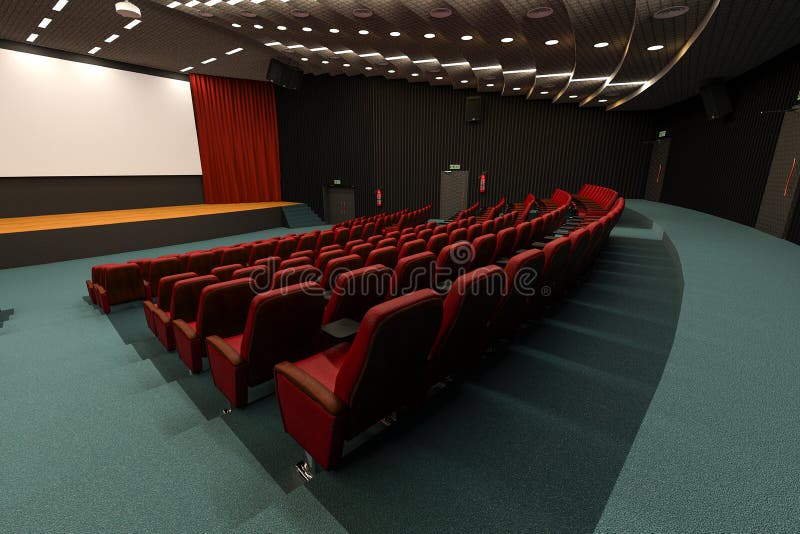
You are a GUI agent. You are given a task and a screenshot of the screen. Output one action in this format:
    pyautogui.click(x=<x>, y=<y>)
    Task: Click on the stage steps
    Image resolution: width=800 pixels, height=534 pixels.
    Given the screenshot: What is the action you would take?
    pyautogui.click(x=296, y=226), pyautogui.click(x=296, y=221), pyautogui.click(x=293, y=215), pyautogui.click(x=290, y=210), pyautogui.click(x=286, y=207)